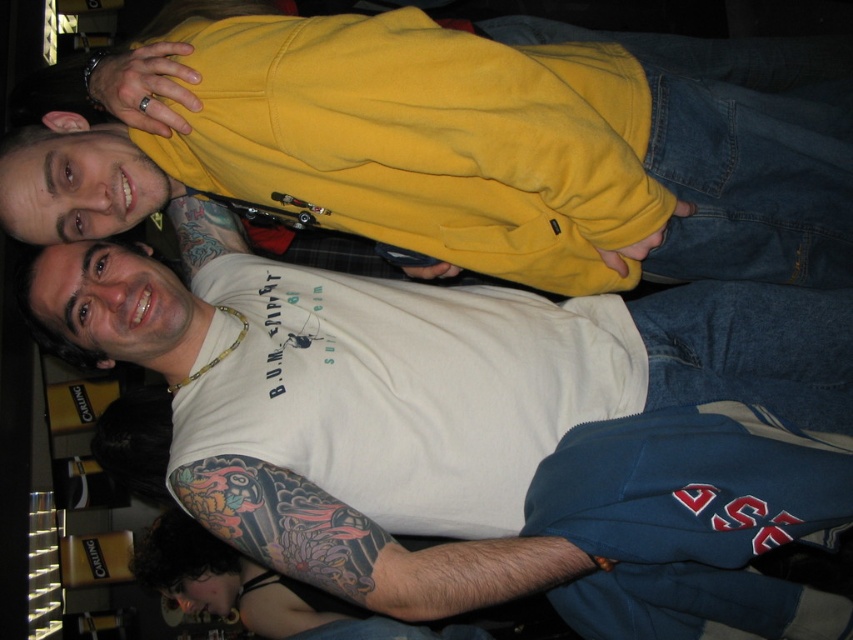
Looking at this image, can you confirm if yellow matte sweatshirt at upper center is taller than colored tattooed arm at lower left?

Yes, yellow matte sweatshirt at upper center is taller than colored tattooed arm at lower left.

Can you confirm if yellow matte sweatshirt at upper center is positioned above colored tattooed arm at lower left?

Indeed, yellow matte sweatshirt at upper center is positioned over colored tattooed arm at lower left.

Is point (782, 177) more distant than point (341, 596)?

That is True.

In order to click on yellow matte sweatshirt at upper center in this screenshot , I will do `click(469, 145)`.

Find the location of a particular element. Image resolution: width=853 pixels, height=640 pixels. white matte t-shirt at center is located at coordinates (352, 406).

The height and width of the screenshot is (640, 853). Find the location of `white matte t-shirt at center`. white matte t-shirt at center is located at coordinates (352, 406).

In the scene shown: Is yellow matte sweatshirt at upper center positioned in front of white matte t-shirt at center?

Yes, yellow matte sweatshirt at upper center is in front of white matte t-shirt at center.

Which is more to the left, yellow matte sweatshirt at upper center or white matte t-shirt at center?

white matte t-shirt at center

Image resolution: width=853 pixels, height=640 pixels. What do you see at coordinates (469, 145) in the screenshot?
I see `yellow matte sweatshirt at upper center` at bounding box center [469, 145].

What are the coordinates of `yellow matte sweatshirt at upper center` in the screenshot? It's located at (469, 145).